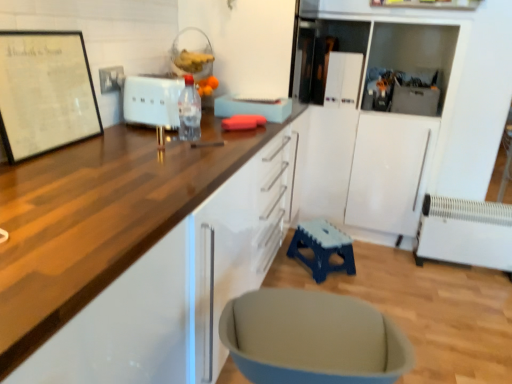
This screenshot has width=512, height=384. I want to click on white matte toaster at center, which is the third appliance in back-to-front order, so click(x=152, y=101).

Measure the distance between white glossy refrigerator at upper center, the first appliance in the back-to-front sequence, and camera.

A distance of 8.12 feet exists between white glossy refrigerator at upper center, the first appliance in the back-to-front sequence, and camera.

The image size is (512, 384). I want to click on metallic gray toolbox at upper right, the 3th appliance in the left-to-right sequence, so click(415, 99).

Find the location of a particular element. The image size is (512, 384). transparent plastic bottle at center is located at coordinates (189, 111).

This screenshot has width=512, height=384. What are the coordinates of `white matte toaster at center, the 3th appliance from the right` in the screenshot? It's located at (152, 101).

Is white glossy refrigerator at upper center, the 3th appliance when ordered from front to back, to the left of matte gray swivel chair at lower center from the viewer's perspective?

No, white glossy refrigerator at upper center, the 3th appliance when ordered from front to back, is not to the left of matte gray swivel chair at lower center.

Based on the photo, can you confirm if white glossy refrigerator at upper center, the 3th appliance when ordered from front to back, is taller than matte gray swivel chair at lower center?

Incorrect, the height of white glossy refrigerator at upper center, the 3th appliance when ordered from front to back, is not larger of that of matte gray swivel chair at lower center.

Can you confirm if white glossy refrigerator at upper center, positioned as the 2th appliance in right-to-left order, is bigger than matte gray swivel chair at lower center?

No, white glossy refrigerator at upper center, positioned as the 2th appliance in right-to-left order, is not bigger than matte gray swivel chair at lower center.

Does white glossy refrigerator at upper center, positioned as the 2th appliance in right-to-left order, have a lesser width compared to matte gray swivel chair at lower center?

Yes.

Which is behind, point (264, 340) or point (457, 223)?

Point (457, 223)

Locate an element on the screen. The image size is (512, 384). radiator above the matte gray swivel chair at lower center (from the image's perspective) is located at coordinates (465, 233).

From the image's perspective, which object appears higher, matte gray swivel chair at lower center or white plastic radiator at lower right?

white plastic radiator at lower right.

Which object is wider, matte gray swivel chair at lower center or white plastic radiator at lower right?

matte gray swivel chair at lower center.

Where is `swivel chair that appears below the white plastic radiator at lower right (from the image's perspective)`? This screenshot has width=512, height=384. swivel chair that appears below the white plastic radiator at lower right (from the image's perspective) is located at coordinates (312, 338).

Is white plastic radiator at lower right shorter than matte gray swivel chair at lower center?

Indeed, white plastic radiator at lower right has a lesser height compared to matte gray swivel chair at lower center.

Between white plastic radiator at lower right and matte gray swivel chair at lower center, which one has larger width?

matte gray swivel chair at lower center is wider.

Is white plastic radiator at lower right positioned with its back to matte gray swivel chair at lower center?

white plastic radiator at lower right does not have its back to matte gray swivel chair at lower center.

How different are the orientations of matte gray swivel chair at lower center and white matte toaster at center, which is the third appliance in back-to-front order, in degrees?

There is a 96.9-degree angle between the facing directions of matte gray swivel chair at lower center and white matte toaster at center, which is the third appliance in back-to-front order.

From the image's perspective, is matte gray swivel chair at lower center positioned above or below white matte toaster at center, placed as the first appliance when sorted from left to right?

From the image's perspective, matte gray swivel chair at lower center appears below white matte toaster at center, placed as the first appliance when sorted from left to right.

From a real-world perspective, does matte gray swivel chair at lower center sit lower than white matte toaster at center, the 3th appliance from the right?

Correct, in the physical world, matte gray swivel chair at lower center is lower than white matte toaster at center, the 3th appliance from the right.

From the picture: Is matte gray swivel chair at lower center looking in the opposite direction of white matte toaster at center, the 3th appliance from the right?

matte gray swivel chair at lower center is not turned away from white matte toaster at center, the 3th appliance from the right.

From the image's perspective, relative to transparent plastic bottle at center, is white matte toaster at center, placed as the first appliance when sorted from left to right, above or below?

Clearly, from the image's perspective, white matte toaster at center, placed as the first appliance when sorted from left to right, is above transparent plastic bottle at center.

Is white matte toaster at center, which is the first appliance in front-to-back order, not within transparent plastic bottle at center?

Absolutely, white matte toaster at center, which is the first appliance in front-to-back order, is external to transparent plastic bottle at center.

From a real-world perspective, is white matte toaster at center, which is the first appliance in front-to-back order, on top of transparent plastic bottle at center?

Actually, white matte toaster at center, which is the first appliance in front-to-back order, is physically below transparent plastic bottle at center in the real world.

Is blue plastic stool at lower center at the back of matte gray swivel chair at lower center?

matte gray swivel chair at lower center does not have its back to blue plastic stool at lower center.

In terms of width, does matte gray swivel chair at lower center look wider or thinner when compared to blue plastic stool at lower center?

matte gray swivel chair at lower center is wider than blue plastic stool at lower center.

Is matte gray swivel chair at lower center bigger than blue plastic stool at lower center?

Indeed, matte gray swivel chair at lower center has a larger size compared to blue plastic stool at lower center.

Can metallic gray toolbox at upper right, the first appliance in the right-to-left sequence, be found inside wooden countertop at upper left?

No, metallic gray toolbox at upper right, the first appliance in the right-to-left sequence, is located outside of wooden countertop at upper left.

Is wooden countertop at upper left positioned before metallic gray toolbox at upper right, acting as the 2th appliance starting from the front?

Yes, wooden countertop at upper left is closer to the camera.

Can you confirm if wooden countertop at upper left is thinner than metallic gray toolbox at upper right, acting as the 2th appliance starting from the front?

In fact, wooden countertop at upper left might be wider than metallic gray toolbox at upper right, acting as the 2th appliance starting from the front.

Can you see wooden countertop at upper left touching metallic gray toolbox at upper right, the first appliance in the right-to-left sequence?

wooden countertop at upper left is not next to metallic gray toolbox at upper right, the first appliance in the right-to-left sequence, and they're not touching.

In the image, there is a white glossy refrigerator at upper center, the second appliance when ordered from left to right. Identify the location of swivel chair below it (from the image's perspective). (312, 338).

The height and width of the screenshot is (384, 512). I want to click on radiator that is behind the matte gray swivel chair at lower center, so click(465, 233).

When comparing their distances from white glossy refrigerator at upper center, the 3th appliance when ordered from front to back, does metallic gray toolbox at upper right, acting as the 2th appliance starting from the front, or white plastic radiator at lower right seem closer?

Based on the image, metallic gray toolbox at upper right, acting as the 2th appliance starting from the front, appears to be nearer to white glossy refrigerator at upper center, the 3th appliance when ordered from front to back.

Considering their positions, is white plastic radiator at lower right positioned further to metallic gray toolbox at upper right, marked as the 2th appliance in a back-to-front arrangement, than white paper at upper left?

white paper at upper left.

Looking at the image, which one is located closer to matte gray swivel chair at lower center, blue plastic stool at lower center or white matte toaster at center, placed as the first appliance when sorted from left to right?

white matte toaster at center, placed as the first appliance when sorted from left to right.

Based on the photo, estimate the real-world distances between objects in this image. Which object is closer to white glossy refrigerator at upper center, the first appliance in the back-to-front sequence, white paper at upper left or white matte toaster at center, which is the first appliance in front-to-back order?

The object closer to white glossy refrigerator at upper center, the first appliance in the back-to-front sequence, is white matte toaster at center, which is the first appliance in front-to-back order.

In the scene shown: Looking at the image, which one is located further to white paper at upper left, metallic gray toolbox at upper right, the 3th appliance in the left-to-right sequence, or white glossy refrigerator at upper center, positioned as the 2th appliance in right-to-left order?

Based on the image, metallic gray toolbox at upper right, the 3th appliance in the left-to-right sequence, appears to be further to white paper at upper left.

Which object lies further to the anchor point transparent plastic bottle at center, wooden countertop at upper left or blue plastic stool at lower center?

blue plastic stool at lower center is positioned further to the anchor transparent plastic bottle at center.

Based on their spatial positions, is matte gray swivel chair at lower center or white glossy refrigerator at upper center, the first appliance in the back-to-front sequence, closer to white matte toaster at center, which is the third appliance in back-to-front order?

matte gray swivel chair at lower center is closer to white matte toaster at center, which is the third appliance in back-to-front order.

Considering their positions, is white paper at upper left positioned further to blue plastic stool at lower center than white plastic radiator at lower right?

The object further to blue plastic stool at lower center is white paper at upper left.

Identify the location of bottle between white paper at upper left and white matte toaster at center, the 3th appliance from the right, from front to back. (189, 111).

Where is `bottle situated between white paper at upper left and white plastic radiator at lower right from left to right`? Image resolution: width=512 pixels, height=384 pixels. bottle situated between white paper at upper left and white plastic radiator at lower right from left to right is located at coordinates (189, 111).

I want to click on appliance located between white matte toaster at center, which is the first appliance in front-to-back order, and metallic gray toolbox at upper right, marked as the 2th appliance in a back-to-front arrangement, in the left-right direction, so click(343, 79).

Image resolution: width=512 pixels, height=384 pixels. Find the location of `bottle located between matte gray swivel chair at lower center and metallic gray toolbox at upper right, marked as the 2th appliance in a back-to-front arrangement, in the depth direction`. bottle located between matte gray swivel chair at lower center and metallic gray toolbox at upper right, marked as the 2th appliance in a back-to-front arrangement, in the depth direction is located at coordinates (189, 111).